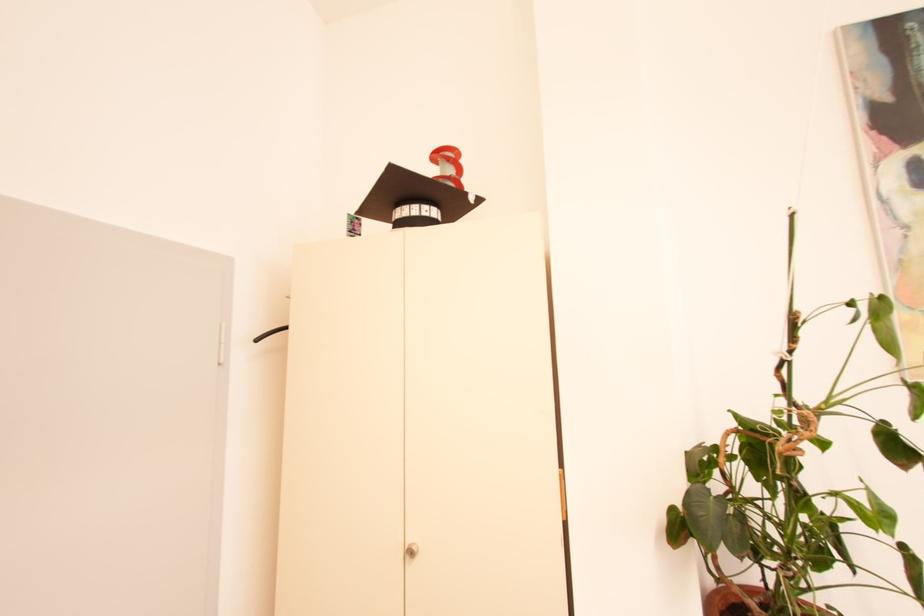
Where is `black clothes hanger`? The height and width of the screenshot is (616, 924). black clothes hanger is located at coordinates (271, 331).